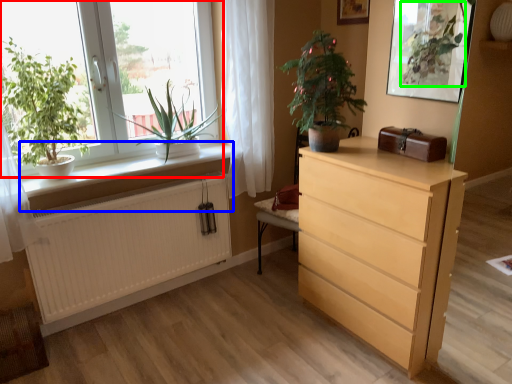
Question: Considering the real-world distances, which object is closest to window (highlighted by a red box)? window sill (highlighted by a blue box) or vegetation (highlighted by a green box).

Choices:
 (A) window sill
 (B) vegetation

Answer: (A)